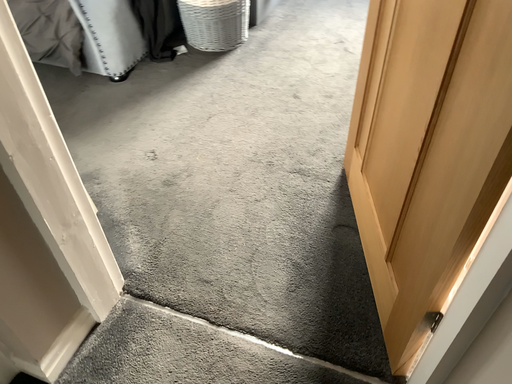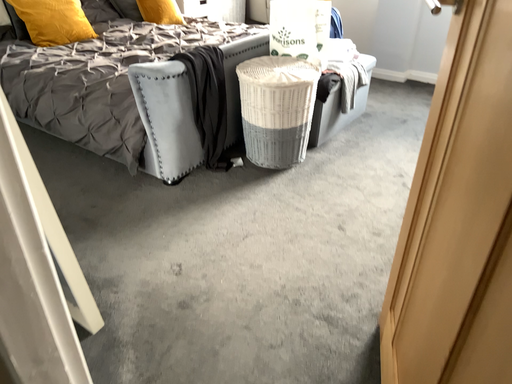
Question: How did the camera likely rotate when shooting the video?

Choices:
 (A) rotated downward
 (B) rotated upward

Answer: (B)